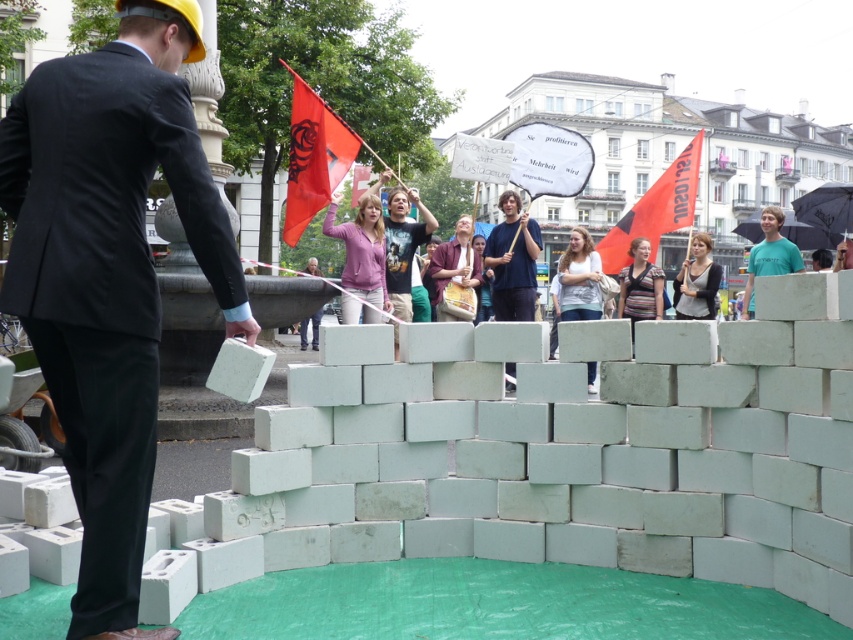
You are a photographer trying to capture the red fabric flag at upper center in your shot. Based on the scene description, where should you position yourself to ensure the flag is centered in your viewfinder?

The red fabric flag at upper center is located at point (312, 156), so positioning yourself directly in front of that coordinate would center it in your viewfinder.